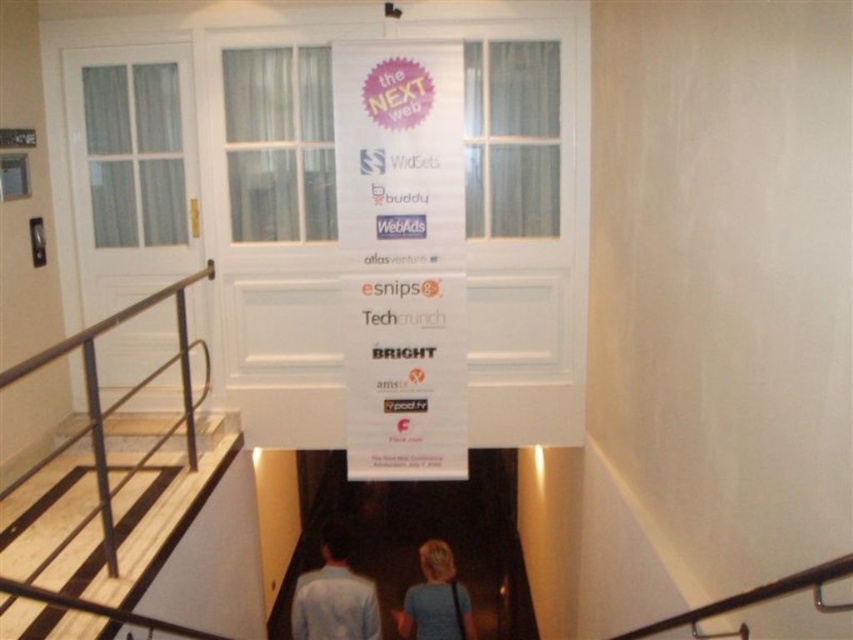
Question: Is light blue shirt at center behind metallic at upper right?

Choices:
 (A) yes
 (B) no

Answer: (A)

Question: Does blonde hair at lower center have a lesser width compared to metallic at upper right?

Choices:
 (A) yes
 (B) no

Answer: (B)

Question: Which of the following is the farthest from the observer?

Choices:
 (A) light blue shirt at center
 (B) white paper banner at center
 (C) metallic at upper right

Answer: (A)

Question: Which object appears closest to the camera in this image?

Choices:
 (A) light blue shirt at center
 (B) metallic at upper right

Answer: (B)

Question: Which object is farther from the camera taking this photo?

Choices:
 (A) metallic at upper right
 (B) blonde hair at lower center

Answer: (B)

Question: Can you confirm if light blue shirt at center is positioned below blonde hair at lower center?

Choices:
 (A) no
 (B) yes

Answer: (A)